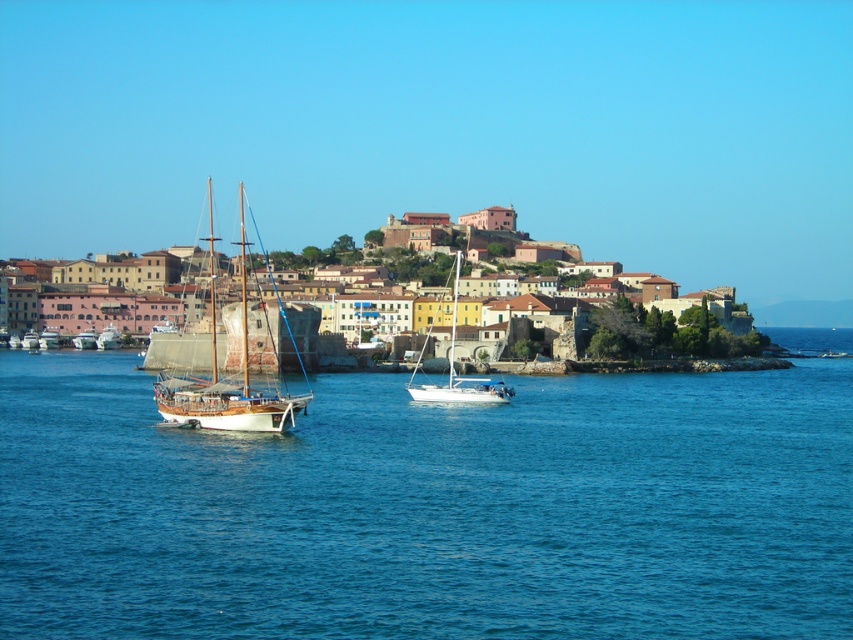
You are a photographer planning to capture a wide shot of the coastal scene. You need to ensure that both the brick stone buildings at center and the white glossy sailboat at center are fully visible in your frame. Based on their widths, can you determine if there is enough space to include both in the shot?

The brick stone buildings at center might be wider than white glossy sailboat at center. Since the buildings could be wider, there might be sufficient space to include both in the shot, but it depends on the exact widths and the camera angle.